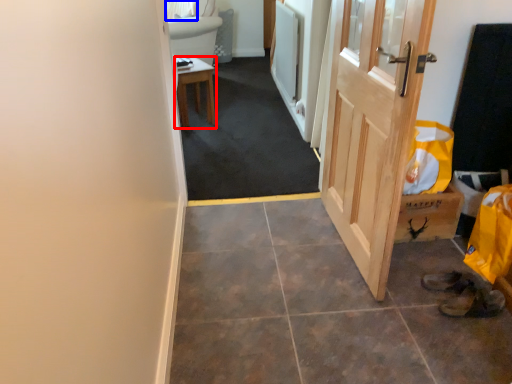
Question: Among these objects, which one is farthest to the camera, furniture (highlighted by a red box) or curtain (highlighted by a blue box)?

Choices:
 (A) furniture
 (B) curtain

Answer: (B)